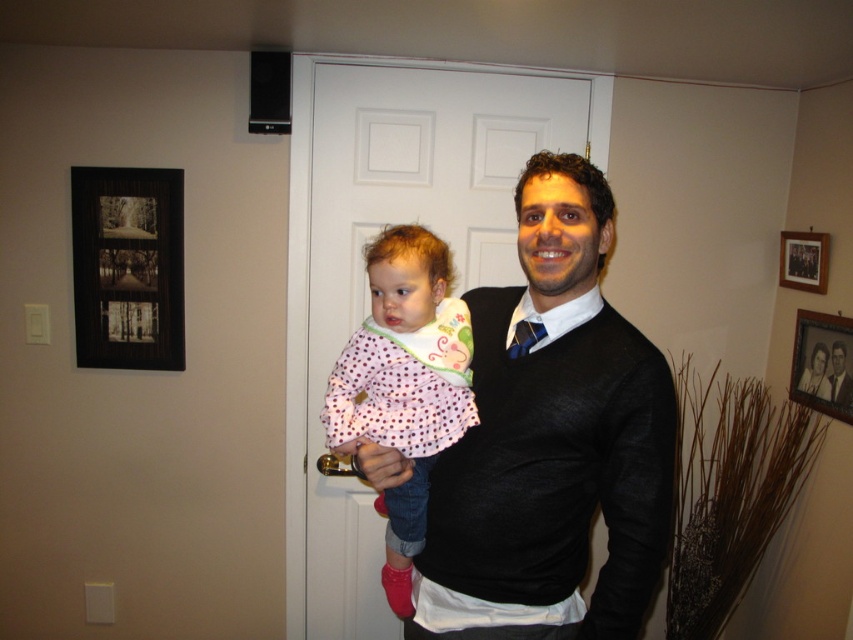
Question: Among these objects, which one is farthest from the camera?

Choices:
 (A) matte black sweater at center
 (B) wooden picture frame at upper right
 (C) black wood picture frame at upper left

Answer: (C)

Question: From the image, what is the correct spatial relationship of pink polka dot fabric at center in relation to wooden picture frame at upper right?

Choices:
 (A) left
 (B) right

Answer: (A)

Question: Which point is farther to the camera?

Choices:
 (A) black wood picture frame at upper left
 (B) wooden framed photo at upper right
 (C) matte black sweater at center

Answer: (A)

Question: Which point appears farthest from the camera in this image?

Choices:
 (A) (666, 492)
 (B) (851, 358)
 (C) (799, 240)
 (D) (410, 244)

Answer: (C)

Question: Can you confirm if matte black sweater at center is positioned to the right of wooden picture frame at upper right?

Choices:
 (A) no
 (B) yes

Answer: (A)

Question: Can you confirm if pink polka dot fabric at center is positioned above wooden framed photo at upper right?

Choices:
 (A) yes
 (B) no

Answer: (B)